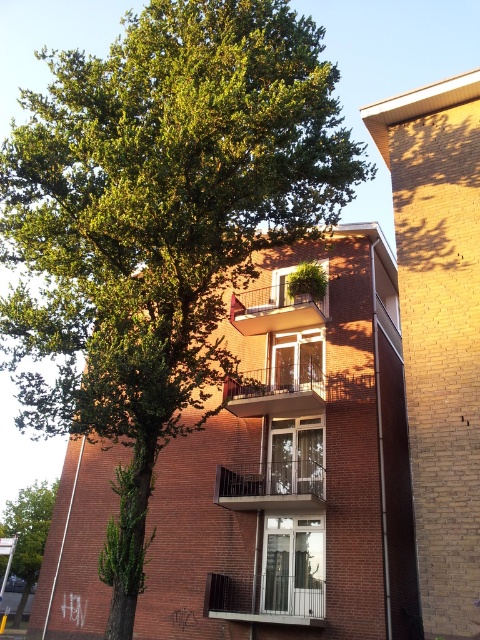
Which is in front, point (269, 388) or point (32, 561)?

Point (269, 388) is in front.

Does point (261, 416) lie in front of point (36, 502)?

Yes, it is in front of point (36, 502).

Locate an element on the screen. This screenshot has height=640, width=480. clear glass balcony at center is located at coordinates (276, 390).

Between white metal balcony at lower center and metallic balcony at center, which one appears on the left side from the viewer's perspective?

Positioned to the left is white metal balcony at lower center.

You are a GUI agent. You are given a task and a screenshot of the screen. Output one action in this format:
    pyautogui.click(x=<x>, y=<y>)
    Task: Click on the white metal balcony at lower center
    The width and height of the screenshot is (480, 640).
    Given the screenshot: What is the action you would take?
    pyautogui.click(x=265, y=598)

Identify the location of white metal balcony at lower center. (265, 598).

Between point (229, 477) and point (15, 616), which one is positioned behind?

The point (15, 616) is behind.

Is black metal balcony at center positioned before green leafy tree at lower left?

Yes.

Is point (242, 492) positioned after point (19, 609)?

No.

Locate an element on the screen. The image size is (480, 640). black metal balcony at center is located at coordinates (272, 486).